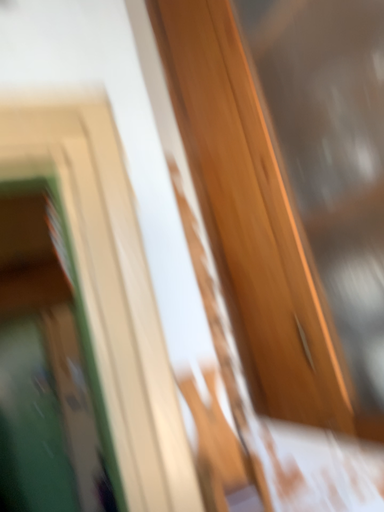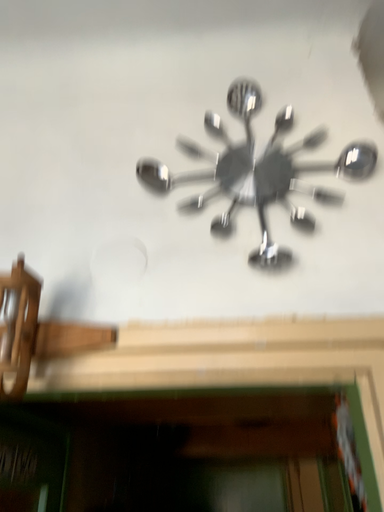
Question: How did the camera likely rotate when shooting the video?

Choices:
 (A) rotated right
 (B) rotated left

Answer: (B)